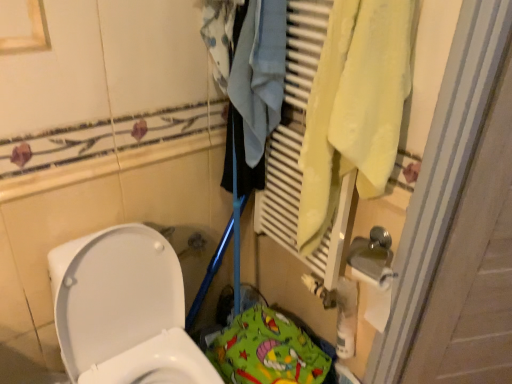
Describe the element at coordinates (124, 310) in the screenshot. I see `white glossy toilet at lower left` at that location.

Where is `white glossy toilet at lower left`? The image size is (512, 384). white glossy toilet at lower left is located at coordinates (124, 310).

Which object is further away from the camera, white glossy toilet at lower left or yellow fabric towel at right?

yellow fabric towel at right is further from the camera.

How far apart are white glossy toilet at lower left and yellow fabric towel at right?

white glossy toilet at lower left and yellow fabric towel at right are 22.84 inches apart.

Is white glossy toilet at lower left facing away from yellow fabric towel at right?

No.

Is white glossy toilet at lower left spatially inside yellow fabric towel at right, or outside of it?

white glossy toilet at lower left is spatially situated outside yellow fabric towel at right.

Is green fabric play mat at lower center facing away from yellow fabric towel at right?

green fabric play mat at lower center is not turned away from yellow fabric towel at right.

Is green fabric play mat at lower center at the left side of yellow fabric towel at right?

Yes.

Where is `bath towel on the right of green fabric play mat at lower center`? bath towel on the right of green fabric play mat at lower center is located at coordinates (354, 107).

Which of these two, green fabric play mat at lower center or yellow fabric towel at right, is wider?

Wider between the two is green fabric play mat at lower center.

Which is in front, point (388, 155) or point (185, 343)?

The point (388, 155) is more forward.

Considering the relative sizes of yellow fabric towel at right and white glossy toilet at lower left in the image provided, is yellow fabric towel at right taller than white glossy toilet at lower left?

In fact, yellow fabric towel at right may be shorter than white glossy toilet at lower left.

In the scene shown: Which of these two, yellow fabric towel at right or white glossy toilet at lower left, is wider?

With larger width is white glossy toilet at lower left.

Is yellow fabric towel at right facing away from white glossy toilet at lower left?

That's not correct — yellow fabric towel at right is not looking away from white glossy toilet at lower left.

From the image's perspective, which one is positioned lower, green fabric play mat at lower center or white glossy toilet at lower left?

From the image's view, green fabric play mat at lower center is below.

Considering the sizes of objects green fabric play mat at lower center and white glossy toilet at lower left in the image provided, who is wider, green fabric play mat at lower center or white glossy toilet at lower left?

Wider between the two is white glossy toilet at lower left.

Considering the relative sizes of green fabric play mat at lower center and white glossy toilet at lower left in the image provided, is green fabric play mat at lower center shorter than white glossy toilet at lower left?

Correct, green fabric play mat at lower center is not as tall as white glossy toilet at lower left.

Is green fabric play mat at lower center positioned far away from white glossy toilet at lower left?

No, there isn't a large distance between green fabric play mat at lower center and white glossy toilet at lower left.

Can we say yellow fabric towel at right lies outside green fabric play mat at lower center?

Absolutely, yellow fabric towel at right is external to green fabric play mat at lower center.

In terms of height, does yellow fabric towel at right look taller or shorter compared to green fabric play mat at lower center?

Clearly, yellow fabric towel at right is taller compared to green fabric play mat at lower center.

Locate an element on the screen. material that appears on the left of yellow fabric towel at right is located at coordinates (267, 351).

Does yellow fabric towel at right turn towards green fabric play mat at lower center?

No.

Which object is wider, white glossy toilet at lower left or green fabric play mat at lower center?

Wider between the two is white glossy toilet at lower left.

Between white glossy toilet at lower left and green fabric play mat at lower center, which one has less height?

Standing shorter between the two is green fabric play mat at lower center.

From the image's perspective, between white glossy toilet at lower left and green fabric play mat at lower center, who is located below?

green fabric play mat at lower center appears lower in the image.

Is point (69, 250) more distant than point (279, 338)?

That is False.

The image size is (512, 384). I want to click on bath towel above the white glossy toilet at lower left (from the image's perspective), so click(354, 107).

What are the coordinates of `material on the left of yellow fabric towel at right` in the screenshot? It's located at (267, 351).

Based on their spatial positions, is yellow fabric towel at right or white glossy toilet at lower left closer to green fabric play mat at lower center?

The object closer to green fabric play mat at lower center is white glossy toilet at lower left.

From the image, which object appears to be farther from yellow fabric towel at right, white glossy toilet at lower left or green fabric play mat at lower center?

Among the two, green fabric play mat at lower center is located further to yellow fabric towel at right.

Estimate the real-world distances between objects in this image. Which object is further from white glossy toilet at lower left, yellow fabric towel at right or green fabric play mat at lower center?

Among the two, yellow fabric towel at right is located further to white glossy toilet at lower left.

Looking at the image, which one is located further to white glossy toilet at lower left, green fabric play mat at lower center or yellow fabric towel at right?

yellow fabric towel at right.

Based on their spatial positions, is green fabric play mat at lower center or white glossy toilet at lower left closer to yellow fabric towel at right?

The object closer to yellow fabric towel at right is white glossy toilet at lower left.

From the picture: Which object lies nearer to the anchor point green fabric play mat at lower center, white glossy toilet at lower left or yellow fabric towel at right?

white glossy toilet at lower left is positioned closer to the anchor green fabric play mat at lower center.

Identify the location of toilet between yellow fabric towel at right and green fabric play mat at lower center from top to bottom. The image size is (512, 384). (124, 310).